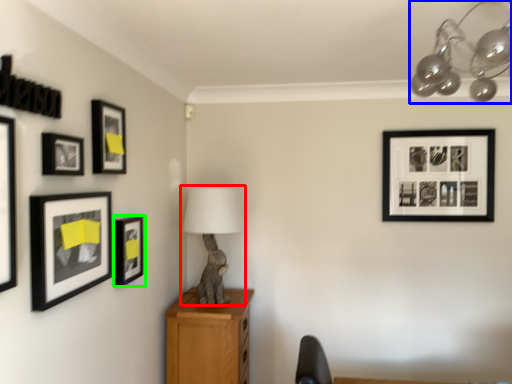
Question: Estimate the real-world distances between objects in this image. Which object is farther from table lamp (highlighted by a red box), lamp (highlighted by a blue box) or picture frame (highlighted by a green box)?

Choices:
 (A) lamp
 (B) picture frame

Answer: (A)